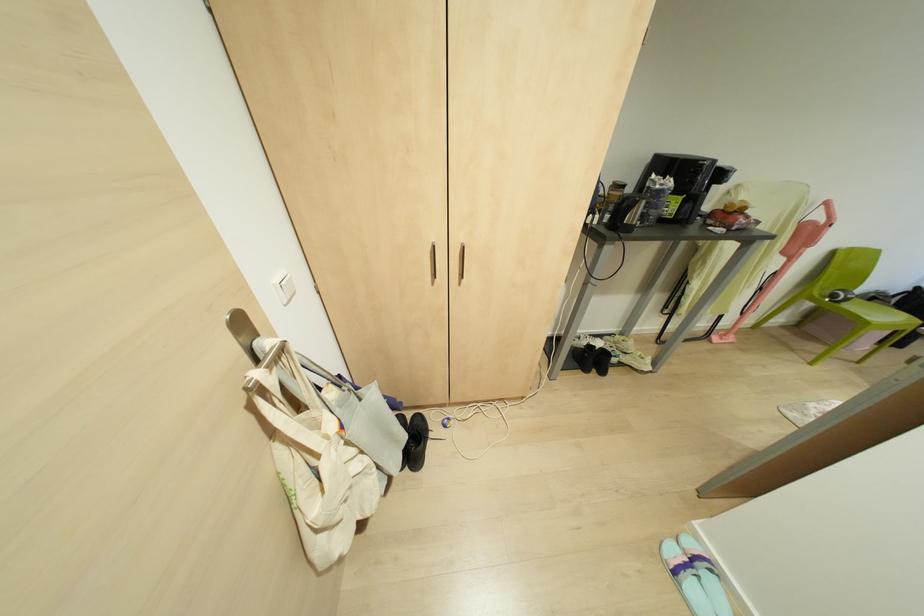
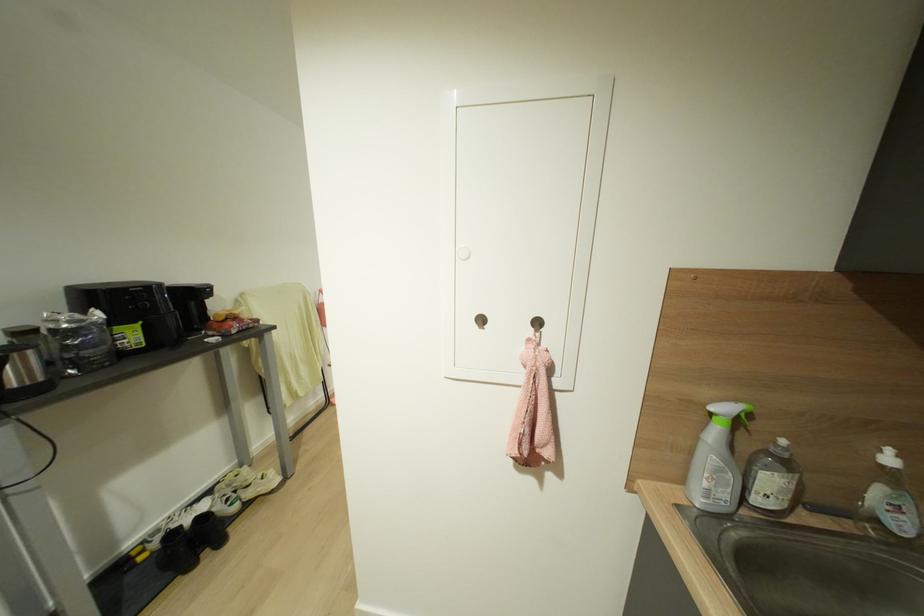
Where in the second image is the point corresponding to [586,370] from the first image?

(189, 565)